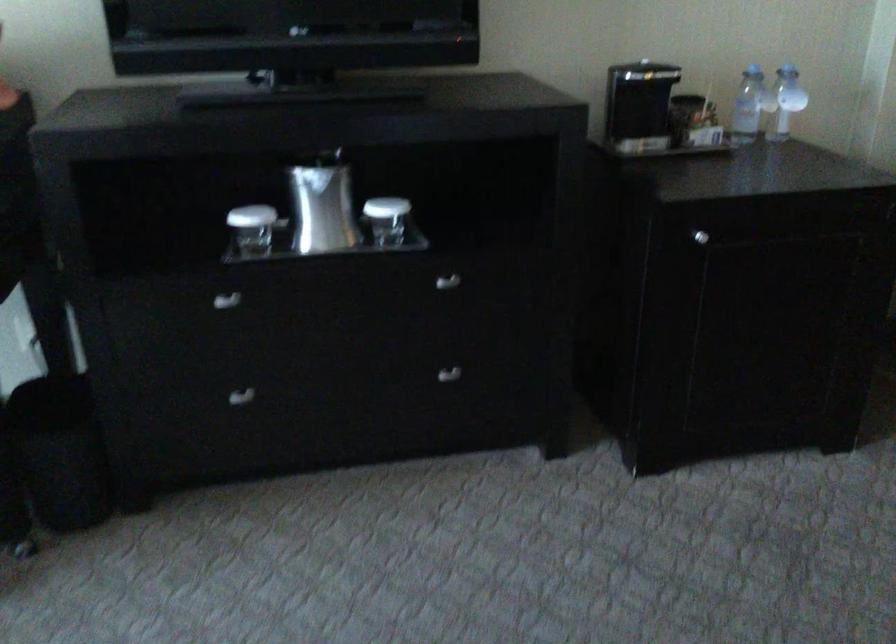
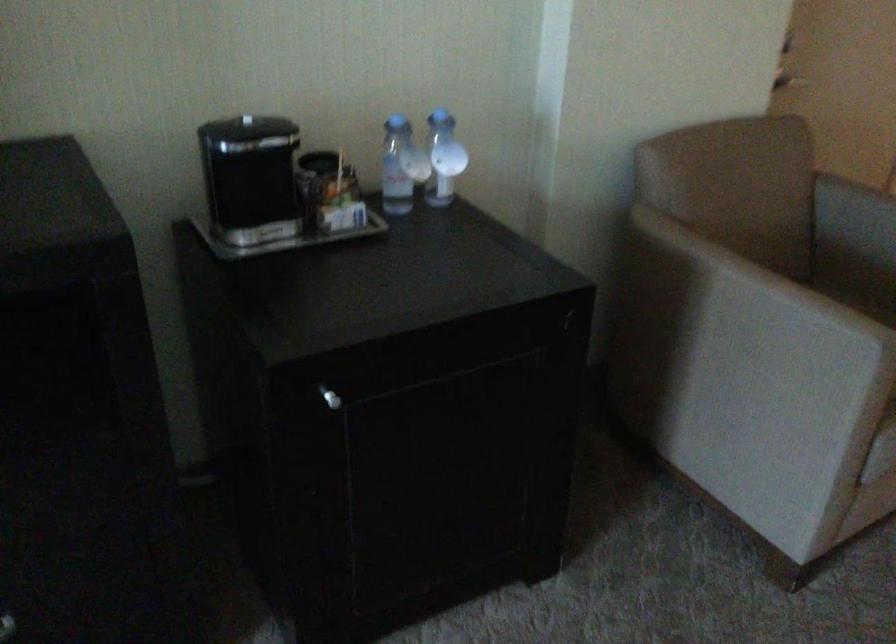
Locate, in the second image, the point that corresponds to point 791,86 in the first image.

(443, 158)